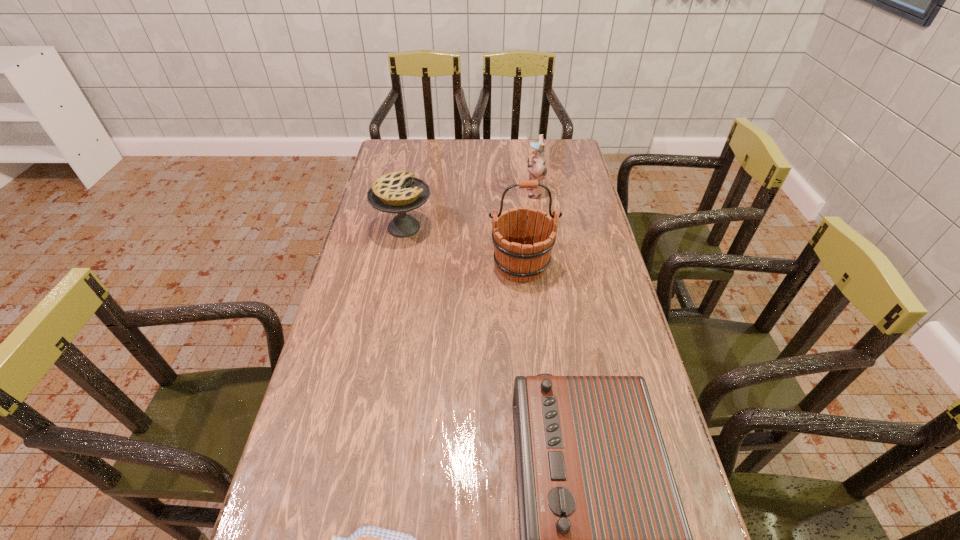
At what (x,y) coordinates should I click in order to perform the action: click on the tallest object. Please return your answer as a coordinate pair (x, y). The width and height of the screenshot is (960, 540). Looking at the image, I should click on (521, 258).

Image resolution: width=960 pixels, height=540 pixels. Find the location of `the farthest object`. the farthest object is located at coordinates (537, 168).

Where is `figurine`? This screenshot has height=540, width=960. figurine is located at coordinates (537, 168).

The image size is (960, 540). Find the location of `the farther pie`. the farther pie is located at coordinates (397, 192).

Locate an element on the screen. The width and height of the screenshot is (960, 540). free spot located on the left of the tallest object is located at coordinates (450, 265).

Find the location of `free space located on the front-facing side of the figurine`. free space located on the front-facing side of the figurine is located at coordinates (448, 191).

The image size is (960, 540). Identify the location of vacant space situated 0.330m on the front-facing side of the figurine. (438, 191).

I want to click on vacant point located 0.330m on the front-facing side of the figurine, so click(x=438, y=191).

The width and height of the screenshot is (960, 540). Identify the location of free spot located 0.150m on the cut side of the farther pie. (477, 227).

Where is `object that is at the left edge`? This screenshot has width=960, height=540. object that is at the left edge is located at coordinates (397, 192).